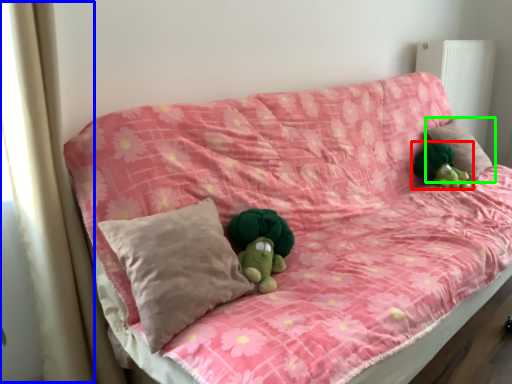
Question: Considering the real-world distances, which object is closest to toy (highlighted by a red box)? curtain (highlighted by a blue box) or pillow (highlighted by a green box).

Choices:
 (A) curtain
 (B) pillow

Answer: (B)